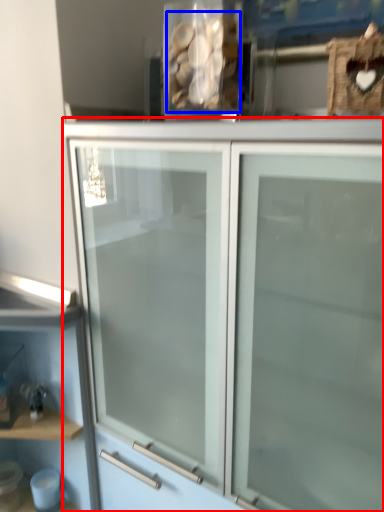
Question: Which object appears farthest to the camera in this image, cupboard (highlighted by a red box) or stuff (highlighted by a blue box)?

Choices:
 (A) cupboard
 (B) stuff

Answer: (B)